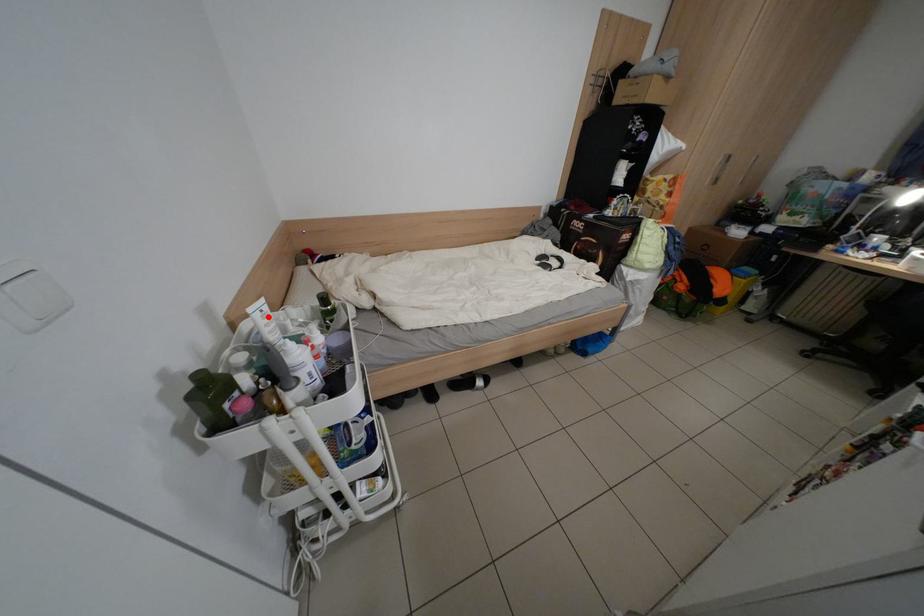
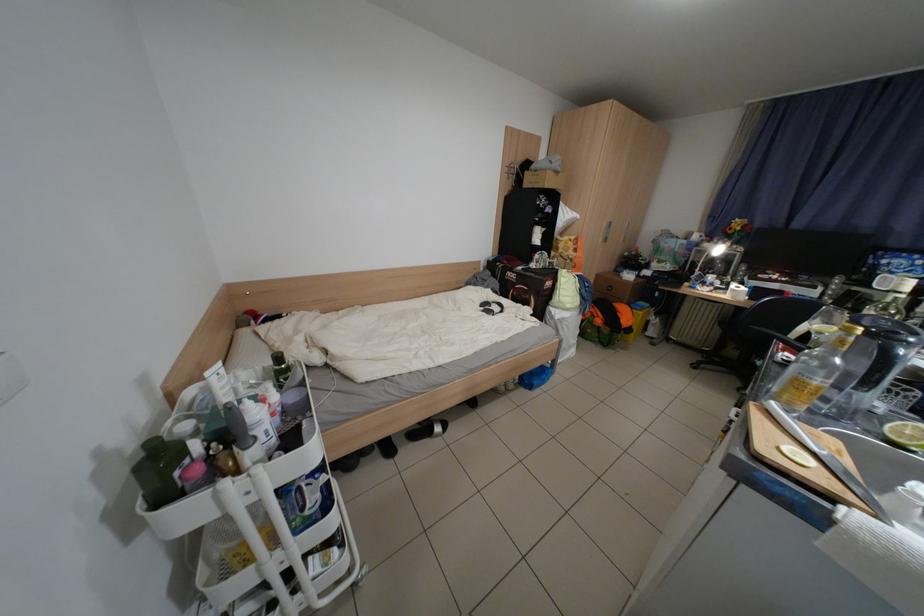
In the second image, find the point that corresponds to the highlighted location in the first image.

(225, 379)